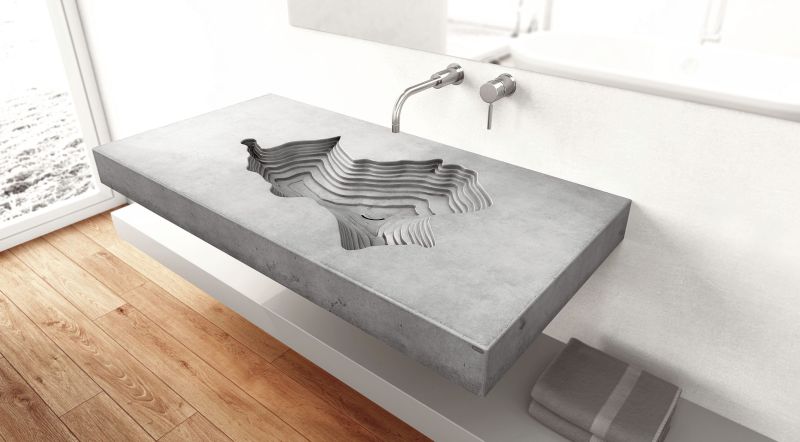
Find the location of a particular element. Image resolution: width=800 pixels, height=442 pixels. shorter faucet is located at coordinates (485, 96).